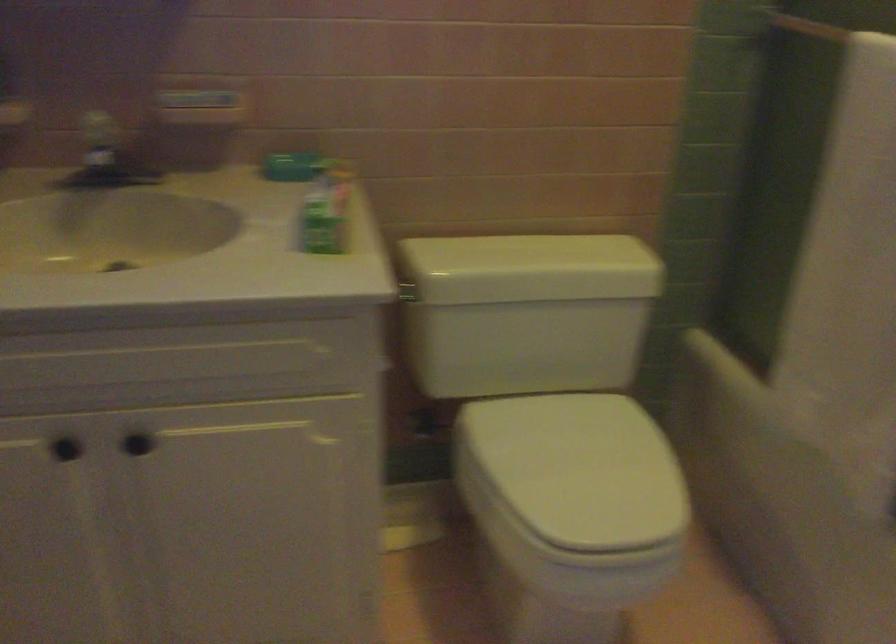
Where would you push the toilet flush lever? Please return your answer as a coordinate pair (x, y).

(406, 292)